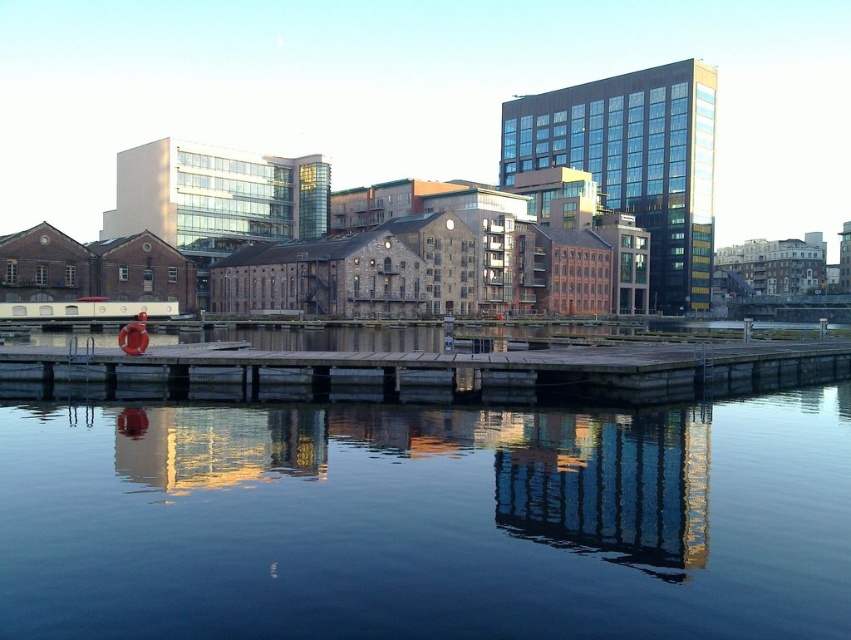
Question: Among these points, which one is farthest from the camera?

Choices:
 (A) (764, 378)
 (B) (818, 481)

Answer: (A)

Question: Does dark blue water at center have a lesser width compared to wooden at center?

Choices:
 (A) no
 (B) yes

Answer: (B)

Question: Does dark blue water at center have a smaller size compared to wooden at center?

Choices:
 (A) yes
 (B) no

Answer: (A)

Question: Among these objects, which one is farthest from the camera?

Choices:
 (A) wooden at center
 (B) dark blue water at center

Answer: (A)

Question: Observing the image, what is the correct spatial positioning of dark blue water at center in reference to wooden at center?

Choices:
 (A) right
 (B) left

Answer: (B)